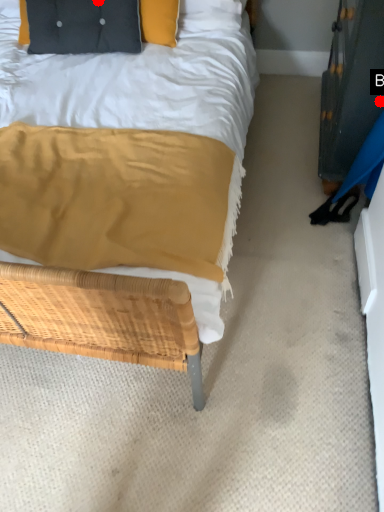
Question: Two points are circled on the image, labeled by A and B beside each circle. Which point is further to the camera?

Choices:
 (A) A is further
 (B) B is further

Answer: (A)